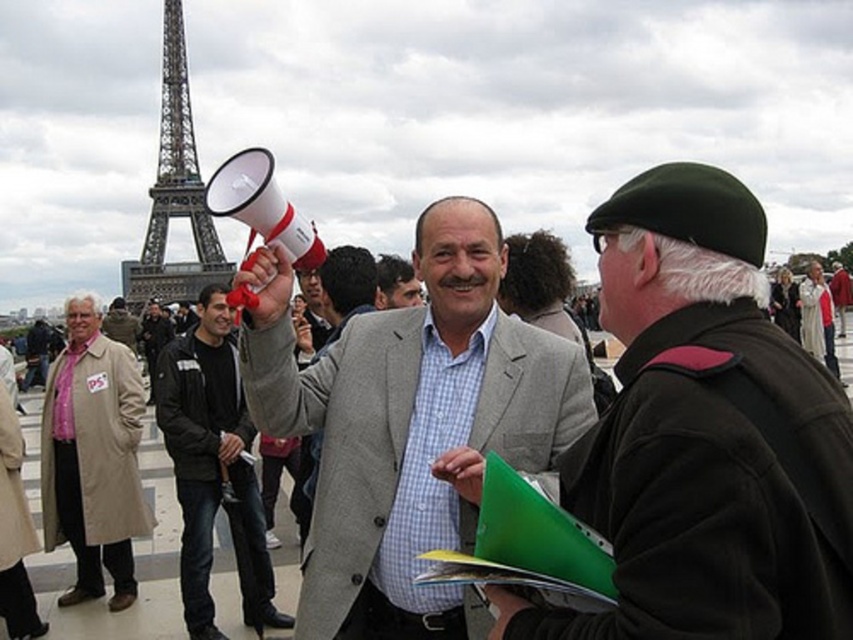
Question: Is gray woolen suit at center positioned in front of beige wool coat at left?

Choices:
 (A) no
 (B) yes

Answer: (B)

Question: Can you confirm if light gray wool jacket at center is bigger than matte black jacket at center?

Choices:
 (A) no
 (B) yes

Answer: (B)

Question: Which point appears farthest from the camera in this image?

Choices:
 (A) coord(204,618)
 (B) coord(177,166)

Answer: (B)

Question: Does light gray wool jacket at center have a larger size compared to gray woolen suit at center?

Choices:
 (A) no
 (B) yes

Answer: (B)

Question: Which object appears closest to the camera in this image?

Choices:
 (A) beige wool coat at left
 (B) gray woolen suit at center
 (C) matte black jacket at center
 (D) metallic gray eiffel tower at upper left

Answer: (D)

Question: Which object is closer to the camera taking this photo?

Choices:
 (A) metallic gray eiffel tower at upper left
 (B) light gray wool jacket at center

Answer: (B)